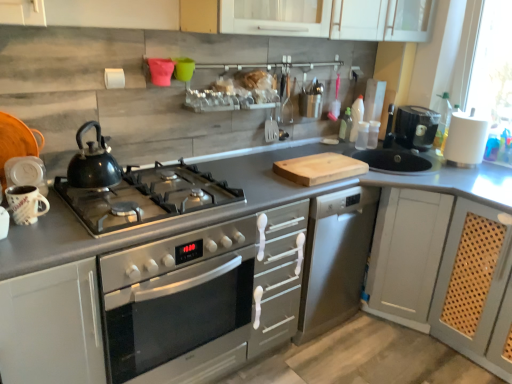
The height and width of the screenshot is (384, 512). In order to click on free space in front of transparent plastic bottle at upper right in this screenshot , I will do `click(337, 150)`.